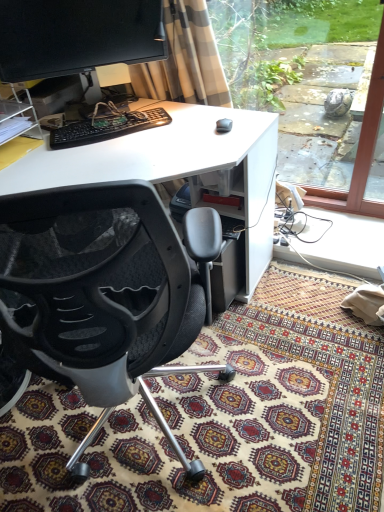
Question: Is transparent glass window at right oriented towards matte black monitor at upper left?

Choices:
 (A) yes
 (B) no

Answer: (B)

Question: Does transparent glass window at right have a smaller size compared to matte black monitor at upper left?

Choices:
 (A) no
 (B) yes

Answer: (A)

Question: Does transparent glass window at right contain matte black monitor at upper left?

Choices:
 (A) no
 (B) yes

Answer: (A)

Question: Does transparent glass window at right have a greater height compared to matte black monitor at upper left?

Choices:
 (A) yes
 (B) no

Answer: (A)

Question: Would you say transparent glass window at right is a long distance from matte black monitor at upper left?

Choices:
 (A) no
 (B) yes

Answer: (B)

Question: Is transparent glass window at right thinner than matte black monitor at upper left?

Choices:
 (A) no
 (B) yes

Answer: (A)

Question: Can you confirm if white plastic desk at center is thinner than matte black monitor at upper left?

Choices:
 (A) no
 (B) yes

Answer: (A)

Question: Considering the relative sizes of white plastic desk at center and matte black monitor at upper left in the image provided, is white plastic desk at center bigger than matte black monitor at upper left?

Choices:
 (A) yes
 (B) no

Answer: (A)

Question: Considering the relative sizes of white plastic desk at center and matte black monitor at upper left in the image provided, is white plastic desk at center smaller than matte black monitor at upper left?

Choices:
 (A) no
 (B) yes

Answer: (A)

Question: From the image's perspective, does white plastic desk at center appear higher than matte black monitor at upper left?

Choices:
 (A) no
 (B) yes

Answer: (A)

Question: Is white plastic desk at center at the left side of matte black monitor at upper left?

Choices:
 (A) yes
 (B) no

Answer: (B)

Question: Is white plastic desk at center taller than matte black monitor at upper left?

Choices:
 (A) yes
 (B) no

Answer: (A)

Question: From the image's perspective, does black mesh chair at center appear lower than matte black monitor at upper left?

Choices:
 (A) yes
 (B) no

Answer: (A)